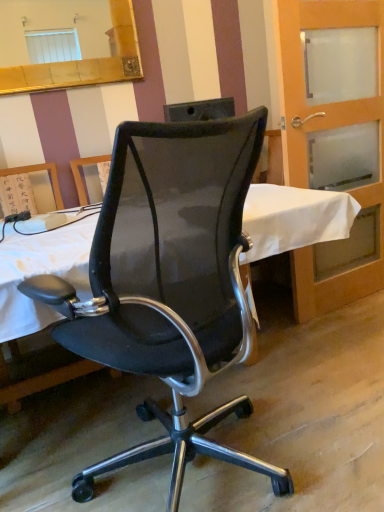
I want to click on free space below black mesh office chair at center (from a real-world perspective), so click(x=219, y=480).